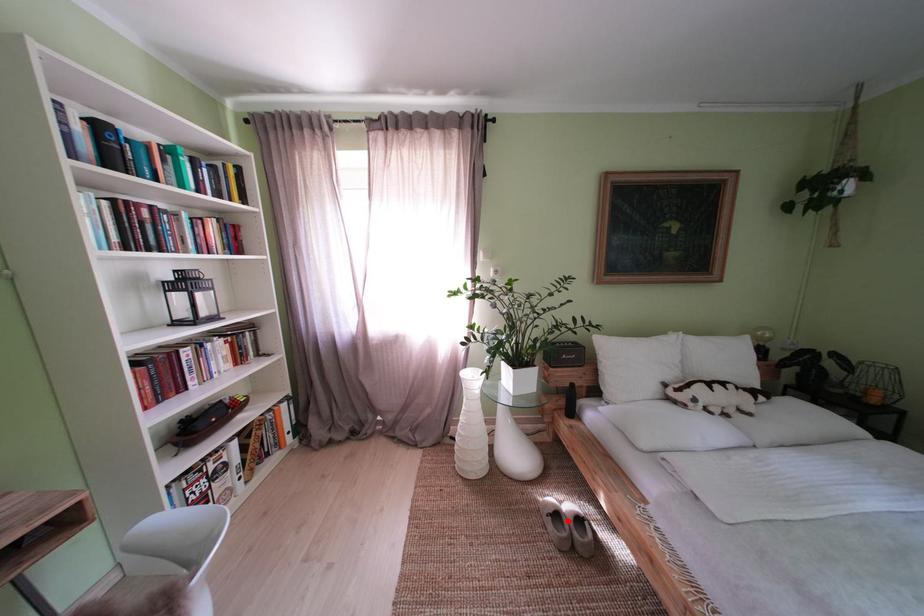
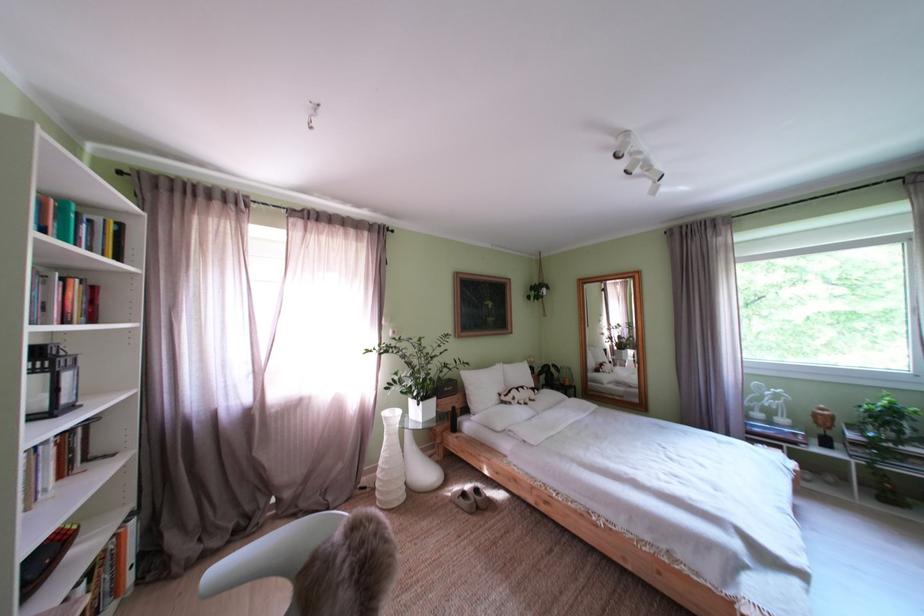
Question: I am providing you with two images of the same scene from different viewpoints. A red point is shown in image1. For the corresponding object point in image2, is it positioned nearer or farther from the camera?

Choices:
 (A) Nearer
 (B) Farther

Answer: (A)